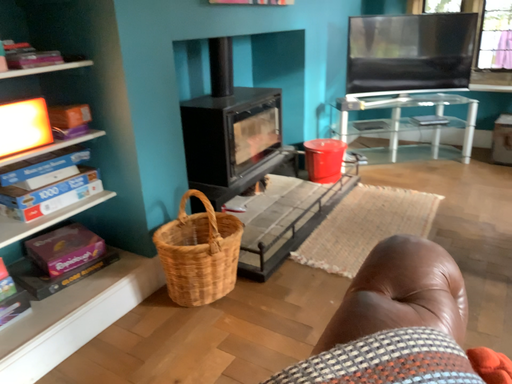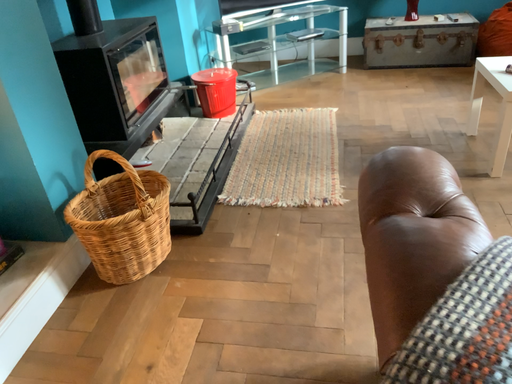
Question: Which way did the camera rotate in the video?

Choices:
 (A) rotated downward
 (B) rotated upward

Answer: (A)